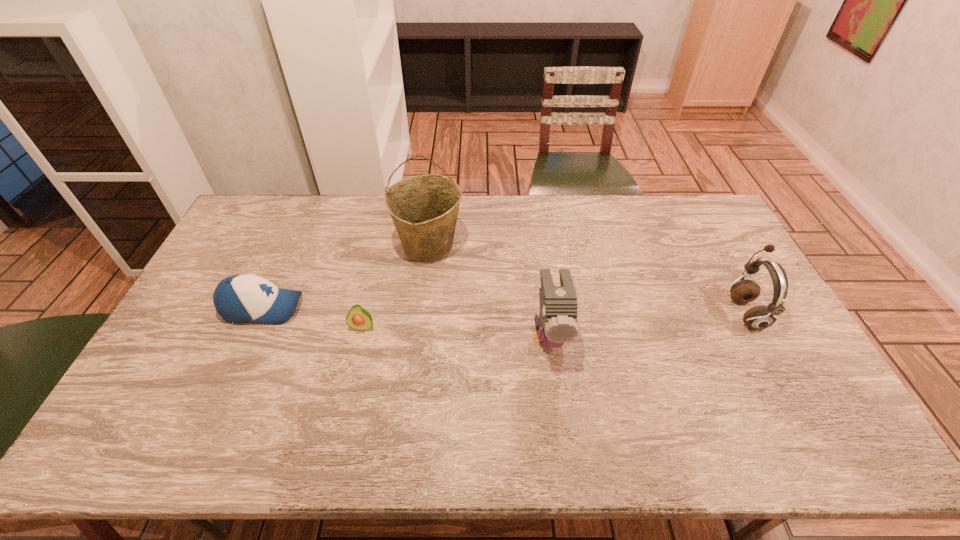
Select which object is the closest to the second object from right to left. Please provide its 2D coordinates. Your answer should be formatted as a tuple, i.e. [(x, y)], where the tuple contains the x and y coordinates of a point satisfying the conditions above.

[(424, 208)]

Find the location of a particular element. free spot that satisfies the following two spatial constraints: 1. on the front side of the wine bucket; 2. on the front-facing side of the baseball cap is located at coordinates (421, 308).

Locate an element on the screen. This screenshot has height=540, width=960. vacant area that satisfies the following two spatial constraints: 1. on the front side of the third object from left to right; 2. on the front-facing side of the baseball cap is located at coordinates (421, 308).

Identify the location of free spot that satisfies the following two spatial constraints: 1. on the ear pads of the earphone; 2. on the cut side of the fourth object from right to left. The width and height of the screenshot is (960, 540). (754, 327).

This screenshot has height=540, width=960. In order to click on vacant point that satisfies the following two spatial constraints: 1. on the ear pads of the earphone; 2. at the beak of the second object from right to left in this screenshot , I will do `click(757, 334)`.